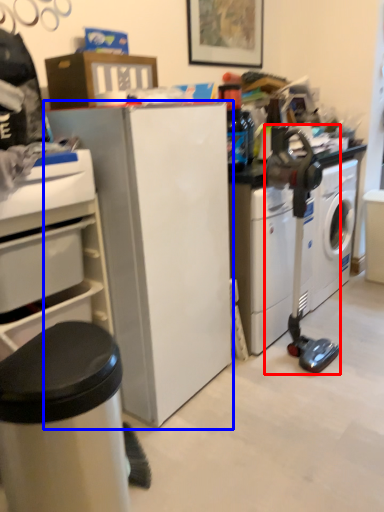
Question: Which object appears closest to the camera in this image, sewing machine (highlighted by a red box) or refrigerator (highlighted by a blue box)?

Choices:
 (A) sewing machine
 (B) refrigerator

Answer: (B)